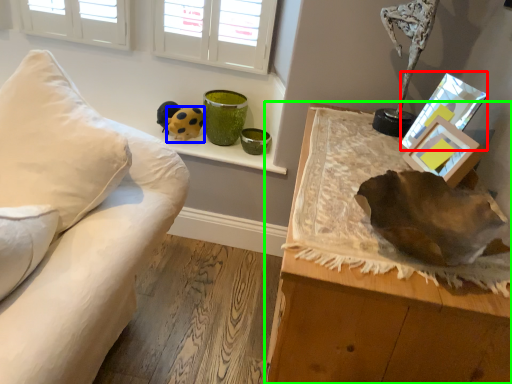
Question: Which object is positioned closest to picture frame (highlighted by a red box)? Select from toy (highlighted by a blue box) and table (highlighted by a green box).

Choices:
 (A) toy
 (B) table

Answer: (B)